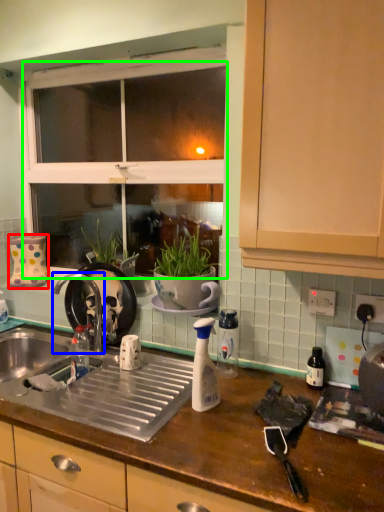
Question: Which object is positioned farthest from appliance (highlighted by a red box)? Select from tap (highlighted by a blue box) and window screen (highlighted by a green box).

Choices:
 (A) tap
 (B) window screen

Answer: (B)